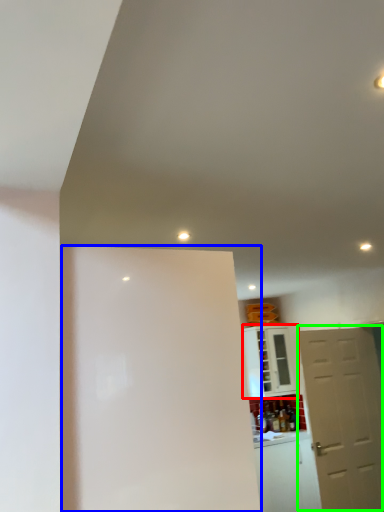
Question: Which is nearer to the cabinetry (highlighted by a red box)? screen door (highlighted by a blue box) or door (highlighted by a green box).

Choices:
 (A) screen door
 (B) door

Answer: (B)